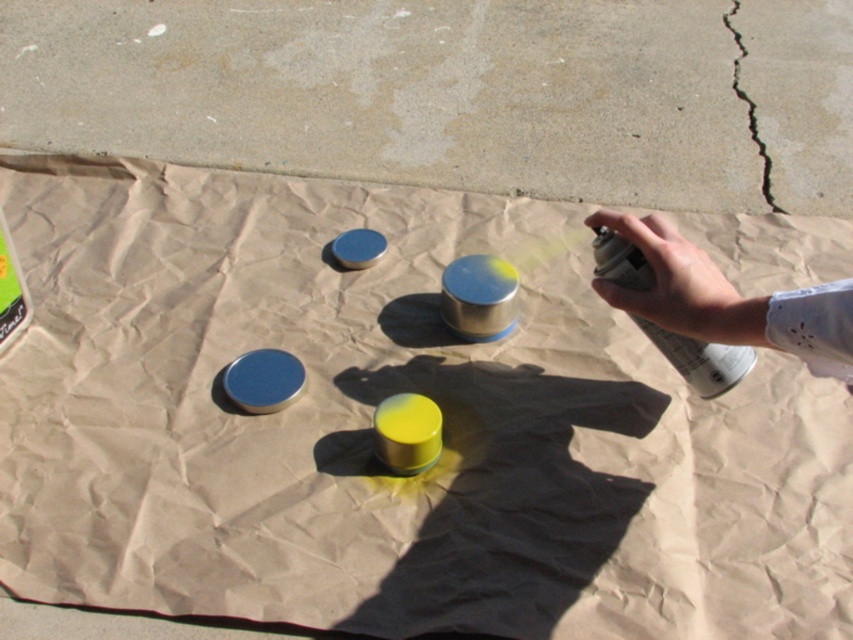
Image resolution: width=853 pixels, height=640 pixels. What do you see at coordinates (729, 300) in the screenshot?
I see `metallic spray can at right` at bounding box center [729, 300].

Consider the image. Is metallic spray can at right positioned in front of cracked concrete at upper right?

Yes, metallic spray can at right is in front of cracked concrete at upper right.

Is point (851, 324) positioned after point (761, 180)?

That is False.

Identify the location of metallic spray can at right. The width and height of the screenshot is (853, 640). (729, 300).